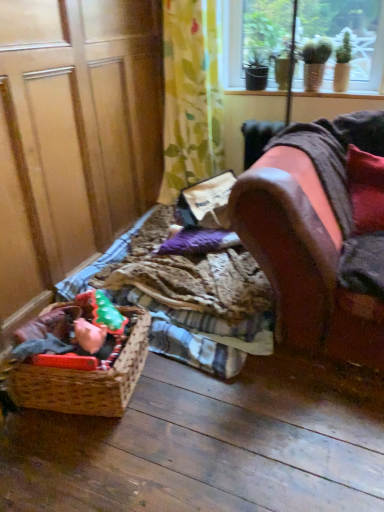
At what (x,y) coordinates should I click in order to perform the action: click on empty space that is ontop of white painted wood at upper center (from a real-world perspective). Please return your answer as a coordinate pair (x, y). This screenshot has height=512, width=384. Looking at the image, I should click on (284, 90).